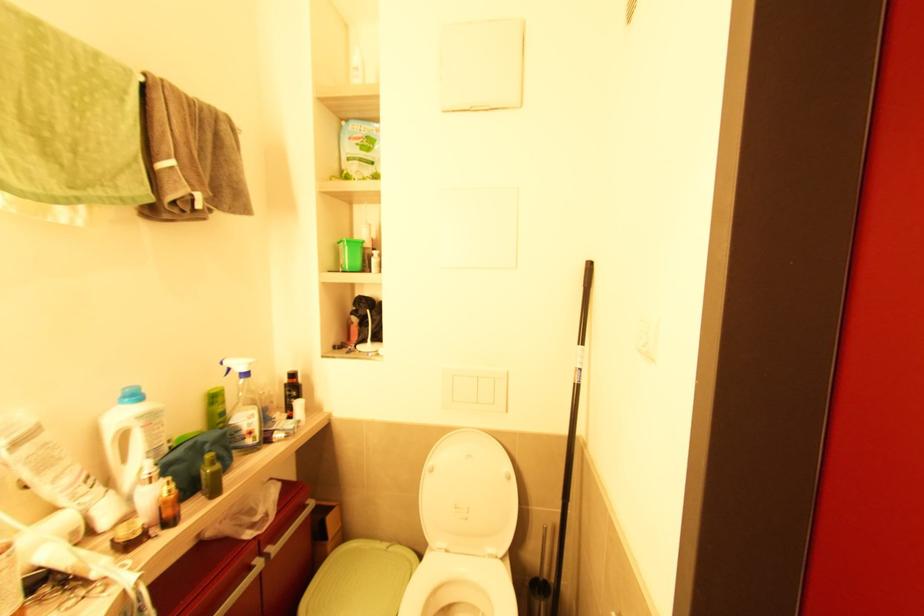
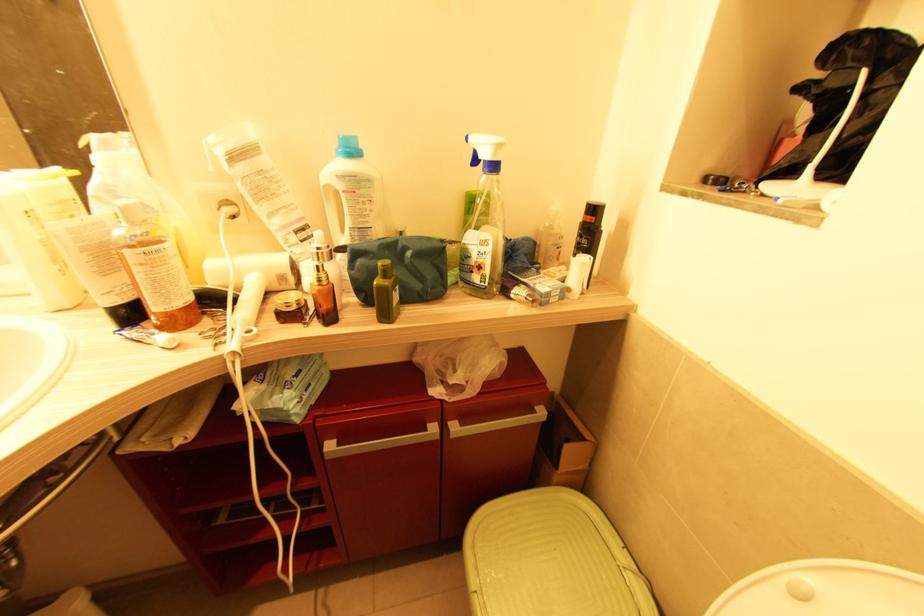
Find the pixel in the second image that matches point (274, 557) in the first image.

(454, 438)